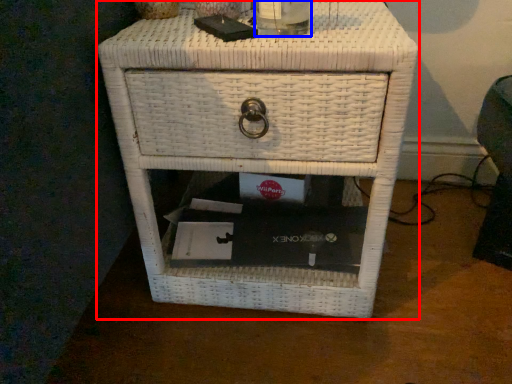
Question: Among these objects, which one is nearest to the camera, nightstand (highlighted by a red box) or beverage (highlighted by a blue box)?

Choices:
 (A) nightstand
 (B) beverage

Answer: (B)